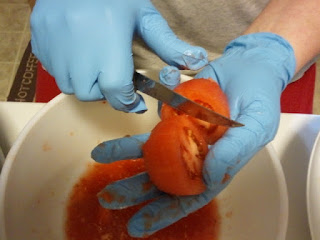
Where is `table`? Image resolution: width=320 pixels, height=240 pixels. table is located at coordinates (295, 144).